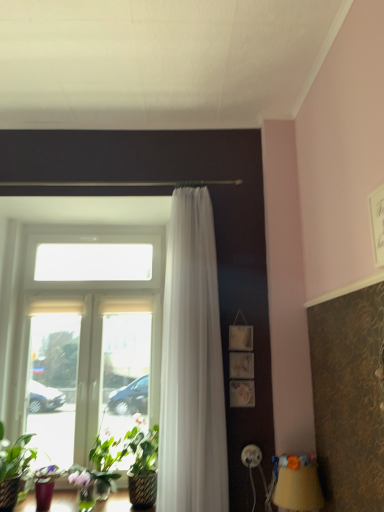
Question: Could you tell me if clear glass window at center is turned towards green leafy plant at lower left?

Choices:
 (A) no
 (B) yes

Answer: (B)

Question: Is there a large distance between clear glass window at center and green leafy plant at lower left?

Choices:
 (A) no
 (B) yes

Answer: (A)

Question: Is the position of clear glass window at center more distant than that of green leafy plant at lower left?

Choices:
 (A) no
 (B) yes

Answer: (B)

Question: Is clear glass window at center positioned beyond the bounds of green leafy plant at lower left?

Choices:
 (A) no
 (B) yes

Answer: (B)

Question: Is clear glass window at center oriented away from green leafy plant at lower left?

Choices:
 (A) yes
 (B) no

Answer: (A)

Question: In the image, is green leafy plant at lower left on the left side or the right side of yellow fabric lampshade at lower right?

Choices:
 (A) left
 (B) right

Answer: (A)

Question: From the image's perspective, is green leafy plant at lower left above or below yellow fabric lampshade at lower right?

Choices:
 (A) above
 (B) below

Answer: (B)

Question: Is green leafy plant at lower left taller or shorter than yellow fabric lampshade at lower right?

Choices:
 (A) tall
 (B) short

Answer: (A)

Question: Considering the positions of green leafy plant at lower left and yellow fabric lampshade at lower right in the image, is green leafy plant at lower left bigger or smaller than yellow fabric lampshade at lower right?

Choices:
 (A) small
 (B) big

Answer: (B)

Question: Considering the relative positions of yellow fabric lampshade at lower right and green leafy plant at lower left in the image provided, is yellow fabric lampshade at lower right to the left or to the right of green leafy plant at lower left?

Choices:
 (A) left
 (B) right

Answer: (B)

Question: Looking at their shapes, would you say yellow fabric lampshade at lower right is wider or thinner than green leafy plant at lower left?

Choices:
 (A) thin
 (B) wide

Answer: (A)

Question: Does point (286, 468) appear closer or farther from the camera than point (16, 497)?

Choices:
 (A) farther
 (B) closer

Answer: (B)

Question: Considering the positions of yellow fabric lampshade at lower right and green leafy plant at lower left in the image, is yellow fabric lampshade at lower right bigger or smaller than green leafy plant at lower left?

Choices:
 (A) big
 (B) small

Answer: (B)

Question: From the image's perspective, is yellow fabric lampshade at lower right positioned above or below white sheer curtain at center?

Choices:
 (A) below
 (B) above

Answer: (A)

Question: In the image, is yellow fabric lampshade at lower right on the left side or the right side of white sheer curtain at center?

Choices:
 (A) left
 (B) right

Answer: (B)